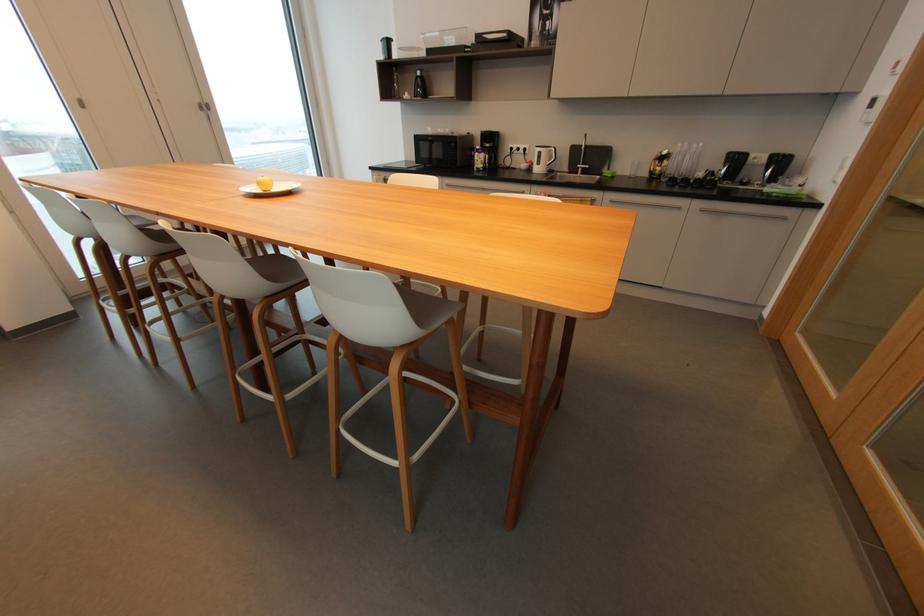
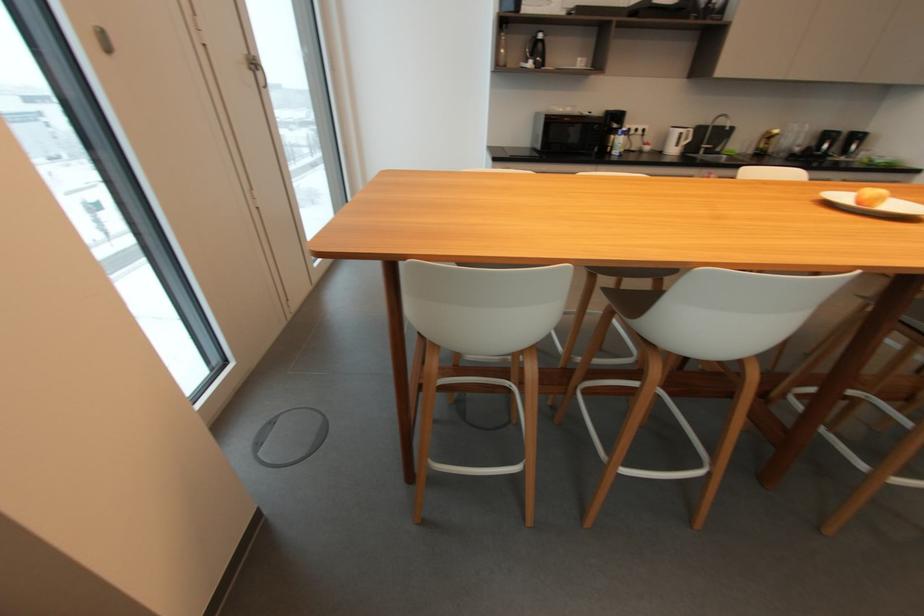
What movement of the cameraman would produce the second image?

The movement direction of the cameraman is left, forward.